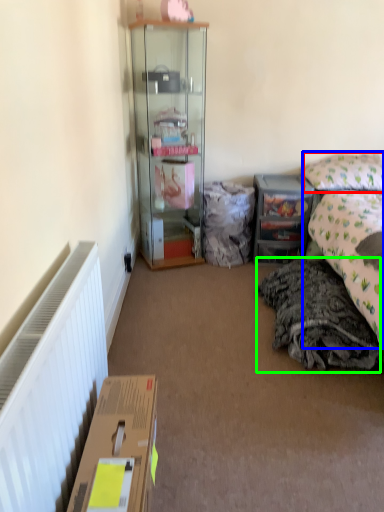
Question: Estimate the real-world distances between objects in this image. Which object is farther from pillow (highlighted by a red box), bed (highlighted by a blue box) or material (highlighted by a green box)?

Choices:
 (A) bed
 (B) material

Answer: (B)